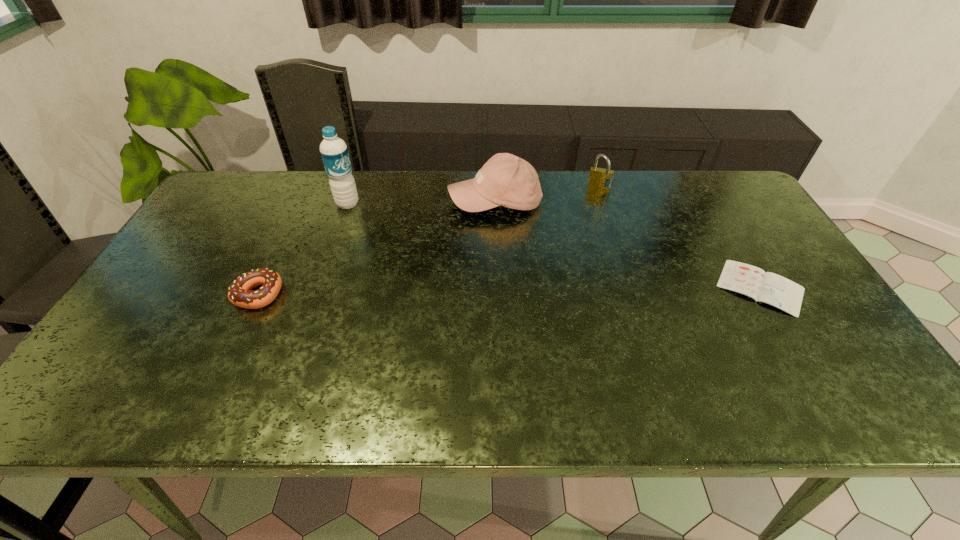
I want to click on free space at the far right corner, so click(x=743, y=205).

Locate an element on the screen. Image resolution: width=960 pixels, height=540 pixels. free point between the water bottle and the shortest object is located at coordinates (554, 246).

This screenshot has height=540, width=960. Identify the location of free space between the second object from right to left and the fourth tallest object. (429, 241).

The image size is (960, 540). I want to click on free space between the diary and the second shortest object, so click(510, 291).

Locate an element on the screen. The image size is (960, 540). free space between the second object from left to right and the baseball cap is located at coordinates pos(421,202).

This screenshot has height=540, width=960. Identify the location of blank region between the fourth shortest object and the shortest object. (628, 244).

At what (x,y) coordinates should I click in order to perform the action: click on free space between the fourth shortest object and the rightmost object. Please return your answer as a coordinate pair (x, y). The image size is (960, 540). Looking at the image, I should click on (628, 244).

The image size is (960, 540). Find the location of `empty space that is in between the rightmost object and the fourth tallest object`. empty space that is in between the rightmost object and the fourth tallest object is located at coordinates (510, 291).

Find the location of a particular element. The height and width of the screenshot is (540, 960). empty space between the fourth tallest object and the water bottle is located at coordinates (303, 249).

Where is `free spot between the water bottle and the doughnut`? The image size is (960, 540). free spot between the water bottle and the doughnut is located at coordinates (303, 249).